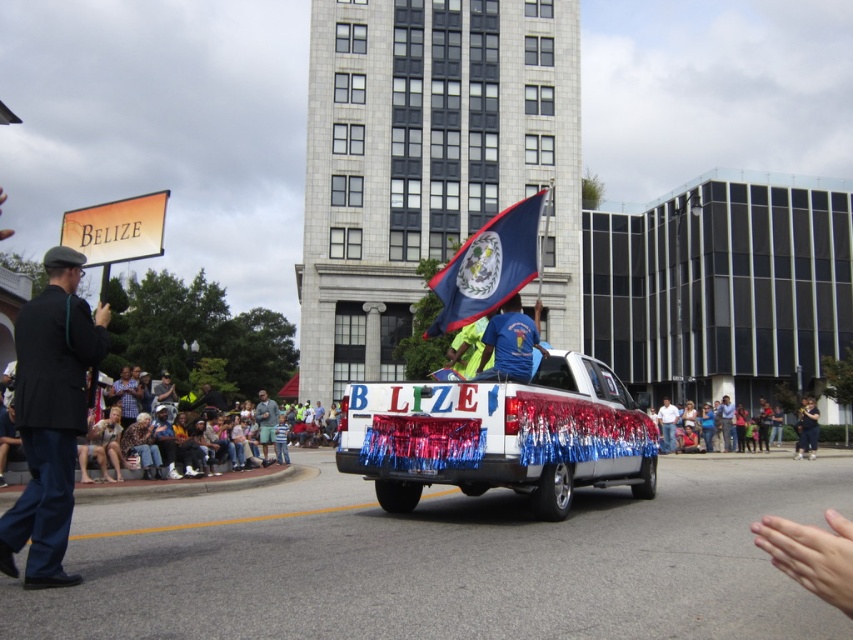
You are standing at the center of the parade route and see the point marked at coordinates [500,435]. What object is located at that point?

The point at coordinates [500,435] corresponds to the shiny metallic truck at center.